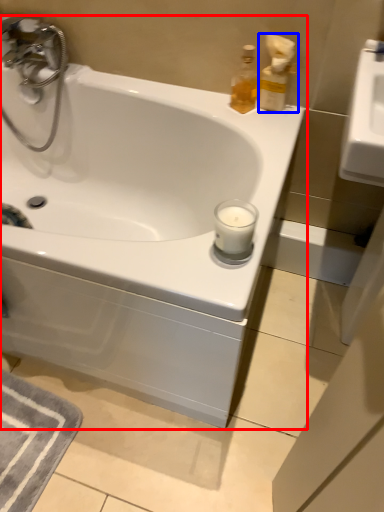
Question: Among these objects, which one is farthest to the camera, bathtub (highlighted by a red box) or soap dispenser (highlighted by a blue box)?

Choices:
 (A) bathtub
 (B) soap dispenser

Answer: (B)